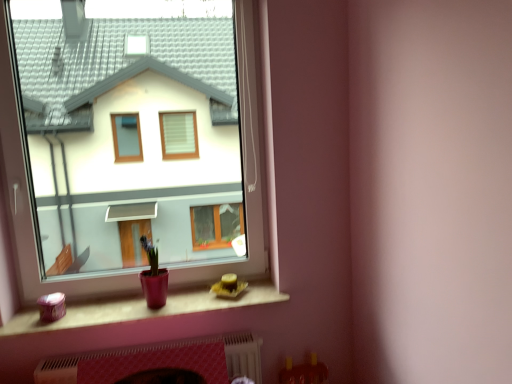
Question: Is matte plastic window sill at lower center positioned with its back to white textured fireplace at lower center?

Choices:
 (A) no
 (B) yes

Answer: (A)

Question: Is the position of matte plastic window sill at lower center more distant than that of white textured fireplace at lower center?

Choices:
 (A) yes
 (B) no

Answer: (B)

Question: Could you tell me if matte plastic window sill at lower center is turned towards white textured fireplace at lower center?

Choices:
 (A) no
 (B) yes

Answer: (A)

Question: Does matte plastic window sill at lower center have a greater width compared to white textured fireplace at lower center?

Choices:
 (A) yes
 (B) no

Answer: (A)

Question: Are matte plastic window sill at lower center and white textured fireplace at lower center making contact?

Choices:
 (A) yes
 (B) no

Answer: (B)

Question: Considering the positions of matte glass window at center and white textured fireplace at lower center in the image, is matte glass window at center wider or thinner than white textured fireplace at lower center?

Choices:
 (A) wide
 (B) thin

Answer: (B)

Question: From the image's perspective, is matte glass window at center above or below white textured fireplace at lower center?

Choices:
 (A) below
 (B) above

Answer: (B)

Question: Considering their positions, is matte glass window at center located in front of or behind white textured fireplace at lower center?

Choices:
 (A) front
 (B) behind

Answer: (A)

Question: Considering the positions of point (158, 208) and point (61, 375), is point (158, 208) closer or farther from the camera than point (61, 375)?

Choices:
 (A) farther
 (B) closer

Answer: (A)

Question: Is matte plastic window sill at lower center bigger or smaller than matte glass window at center?

Choices:
 (A) big
 (B) small

Answer: (B)

Question: From the image's perspective, relative to matte glass window at center, is matte plastic window sill at lower center above or below?

Choices:
 (A) above
 (B) below

Answer: (B)

Question: Considering the positions of matte plastic window sill at lower center and matte glass window at center in the image, is matte plastic window sill at lower center taller or shorter than matte glass window at center?

Choices:
 (A) tall
 (B) short

Answer: (B)

Question: Is matte plastic window sill at lower center wider or thinner than matte glass window at center?

Choices:
 (A) wide
 (B) thin

Answer: (A)

Question: Considering the positions of white textured fireplace at lower center and matte plastic window sill at lower center in the image, is white textured fireplace at lower center wider or thinner than matte plastic window sill at lower center?

Choices:
 (A) wide
 (B) thin

Answer: (B)

Question: From a real-world perspective, is white textured fireplace at lower center positioned above or below matte plastic window sill at lower center?

Choices:
 (A) below
 (B) above

Answer: (A)